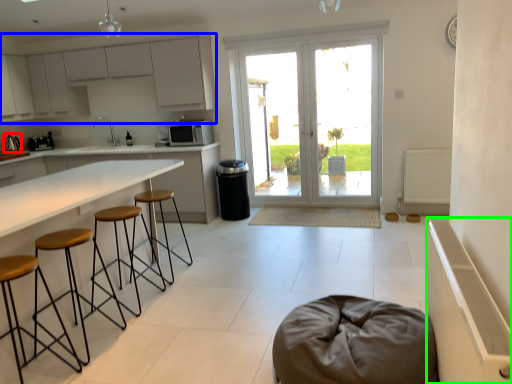
Question: Considering the real-world distances, which object is farthest from appliance (highlighted by a red box)? cabinetry (highlighted by a blue box) or radiator (highlighted by a green box)?

Choices:
 (A) cabinetry
 (B) radiator

Answer: (B)